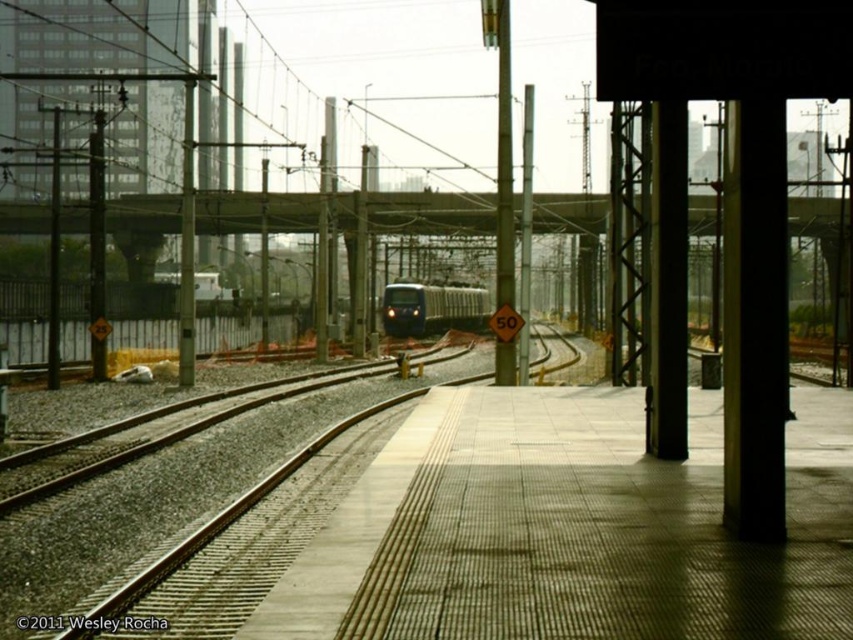
Can you confirm if smooth concrete train track at center is bigger than blue glossy train at center?

Incorrect, smooth concrete train track at center is not larger than blue glossy train at center.

The height and width of the screenshot is (640, 853). What do you see at coordinates (256, 538) in the screenshot?
I see `smooth concrete train track at center` at bounding box center [256, 538].

Where is `smooth concrete train track at center`? Image resolution: width=853 pixels, height=640 pixels. smooth concrete train track at center is located at coordinates click(x=256, y=538).

This screenshot has height=640, width=853. Identify the location of smooth concrete train track at center. click(256, 538).